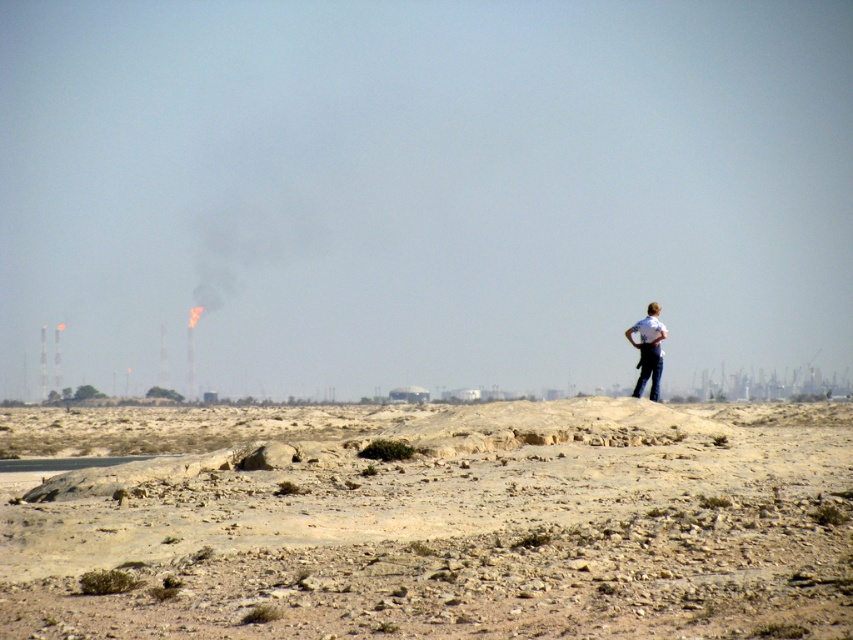
Does point (184, 563) come closer to viewer compared to point (643, 321)?

Yes, point (184, 563) is closer to viewer.

Which of these two, dull brown dirt at center or white shirt at upper right, stands taller?

dull brown dirt at center is taller.

Which is behind, point (165, 470) or point (647, 378)?

The point (647, 378) is behind.

Locate an element on the screen. The height and width of the screenshot is (640, 853). dull brown dirt at center is located at coordinates (440, 522).